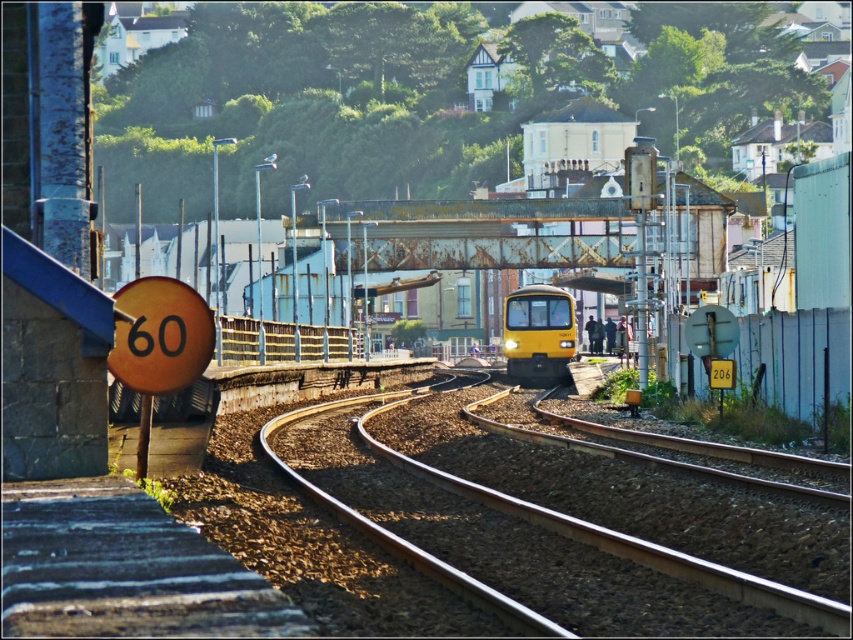
Question: Is metallic tracks at center thinner than yellow matte train at center?

Choices:
 (A) yes
 (B) no

Answer: (B)

Question: Which point appears closest to the camera in this image?

Choices:
 (A) (521, 342)
 (B) (368, 465)

Answer: (B)

Question: Which point is closer to the camera?

Choices:
 (A) yellow matte train at center
 (B) metallic tracks at center

Answer: (B)

Question: From the image, what is the correct spatial relationship of metallic tracks at center in relation to yellow matte train at center?

Choices:
 (A) left
 (B) right

Answer: (A)

Question: Is metallic tracks at center in front of yellow matte train at center?

Choices:
 (A) no
 (B) yes

Answer: (B)